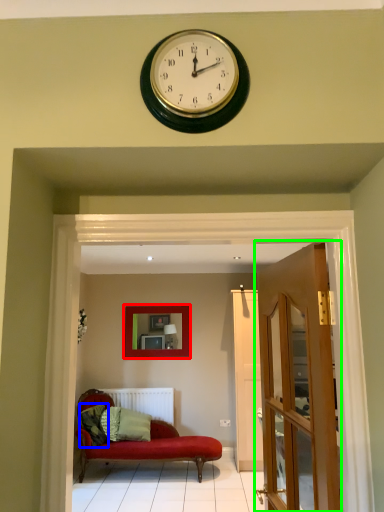
Question: Which object is the farthest from picture frame (highlighted by a red box)? Choose among these: pillow (highlighted by a blue box) or door (highlighted by a green box).

Choices:
 (A) pillow
 (B) door

Answer: (B)